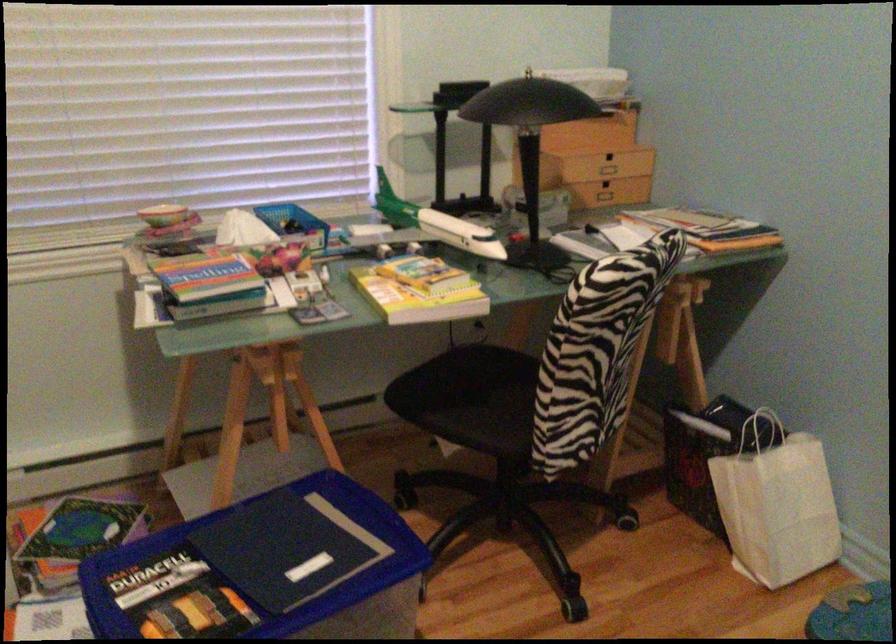
Where is `chair sitting surface`? This screenshot has height=644, width=896. chair sitting surface is located at coordinates (487, 377).